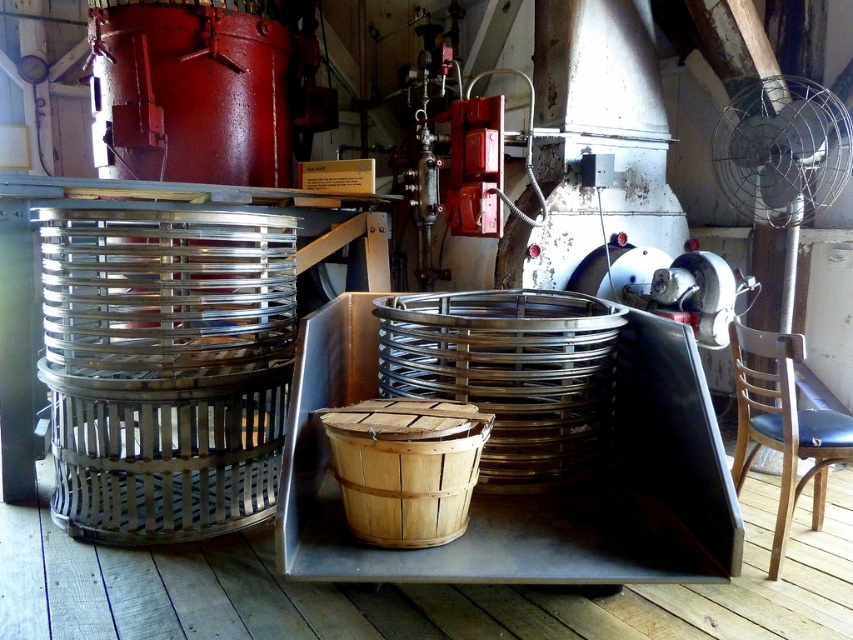
Question: Estimate the real-world distances between objects in this image. Which object is closer to the metallic wire basket at center?

Choices:
 (A) brown wooden chair at right
 (B) natural wood basket at center

Answer: (B)

Question: Among these points, which one is nearest to the camera?

Choices:
 (A) (757, 372)
 (B) (811, 198)
 (C) (412, 532)
 (D) (527, 307)

Answer: (C)

Question: Can you confirm if metallic wire basket at center is bigger than natural wood basket at center?

Choices:
 (A) yes
 (B) no

Answer: (A)

Question: Is metallic wire basket at center below metallic wire mesh fan at upper right?

Choices:
 (A) yes
 (B) no

Answer: (A)

Question: Which of the following is the farthest from the observer?

Choices:
 (A) (828, 93)
 (B) (747, 456)
 (C) (357, 513)

Answer: (A)

Question: Can you confirm if metallic wire mesh fan at upper right is wider than brown wooden chair at right?

Choices:
 (A) no
 (B) yes

Answer: (A)